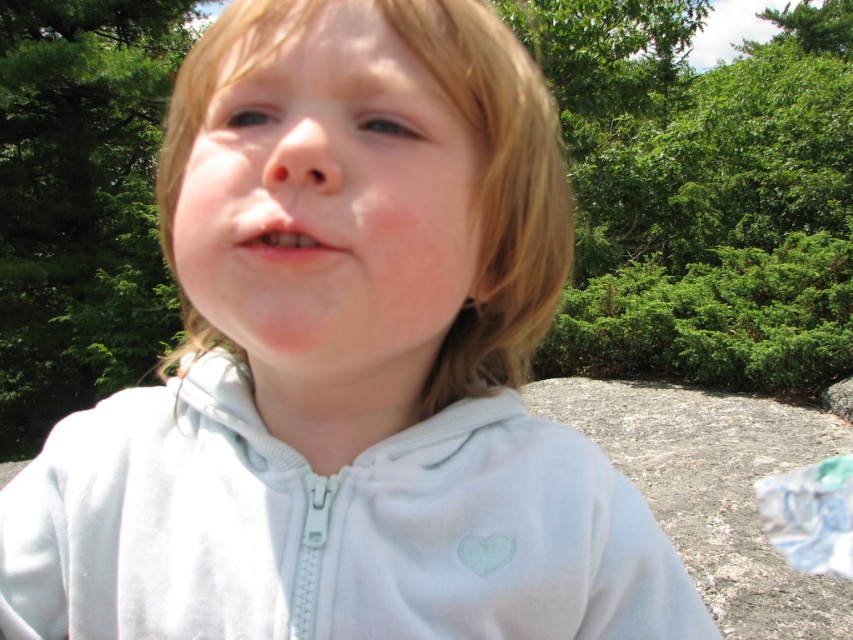
The child in the image is wearing a light blue fleece sweatshirt at center and has pink matte lips at center. Which object is located lower on the child?

The light blue fleece sweatshirt at center is positioned under the pink matte lips at center, so the sweatshirt is lower than the lips.

You are a photographer adjusting your camera settings to focus on the subject in the image. You notice the light blue fleece sweatshirt at center and the smooth skin face at center. Which object should you focus on first if you want to ensure the closer object is sharp?

The light blue fleece sweatshirt at center is closer to the viewer than the smooth skin face at center, so you should focus on the light blue fleece sweatshirt at center first to ensure it is sharp.